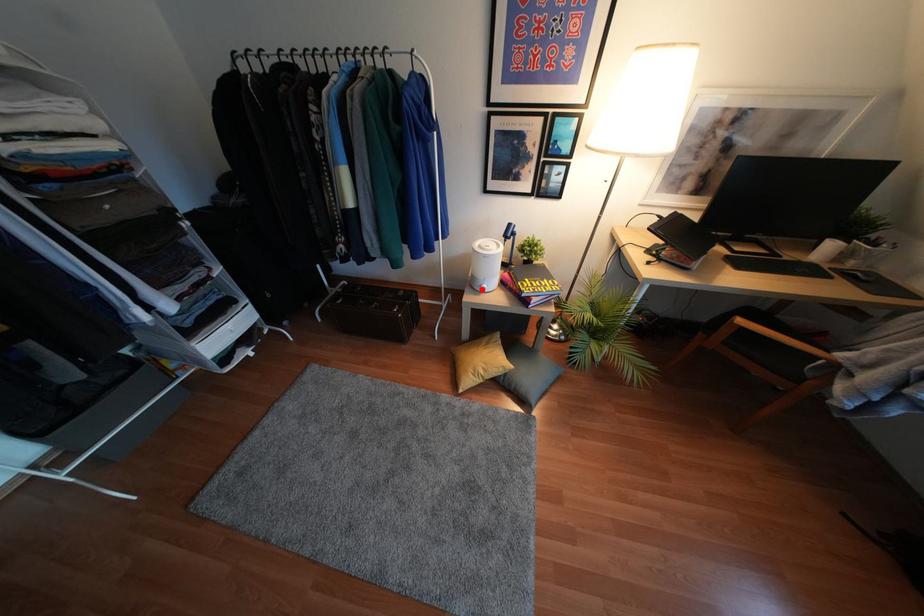
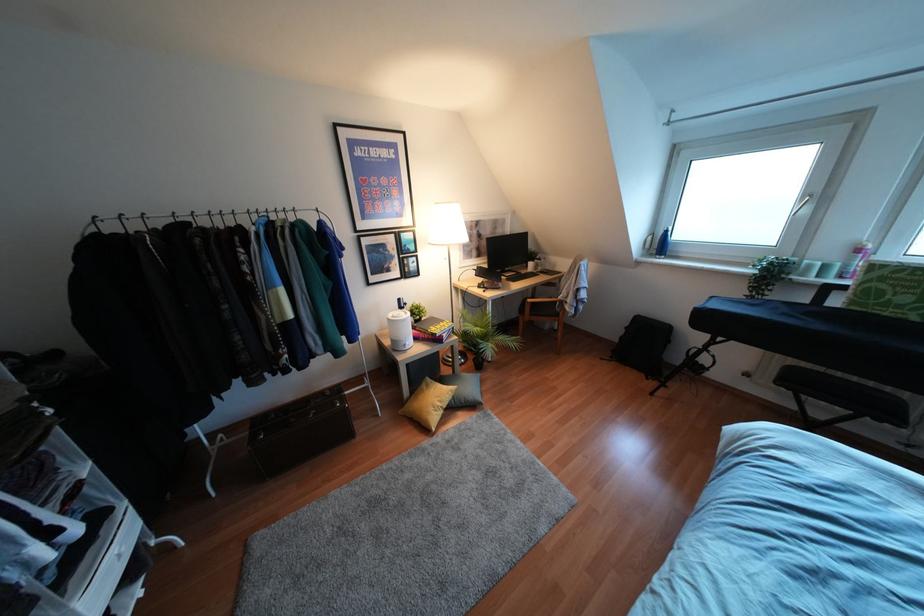
Question: I am providing you with two images of the same scene from different viewpoints. In image1, a red point is highlighted. Considering the same 3D point in image2, which of the following is correct?

Choices:
 (A) It is closer
 (B) It is farther

Answer: (B)